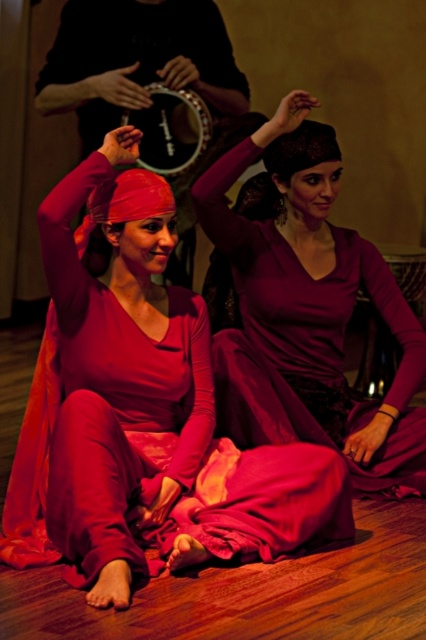
Is point (83, 276) farther from viewer compared to point (195, 125)?

That is False.

Find the location of a particular element. This screenshot has width=426, height=640. matte pink fabric at center is located at coordinates (154, 416).

Find the location of a particular element. This screenshot has height=640, width=426. matte pink fabric at center is located at coordinates (154, 416).

You are a GUI agent. You are given a task and a screenshot of the screen. Output one action in this format:
    pyautogui.click(x=<x>, y=<y>)
    Task: Click on the matte pink fabric at center
    Image resolution: width=426 pixels, height=640 pixels.
    Given the screenshot: What is the action you would take?
    pyautogui.click(x=154, y=416)

Between matte purple dress at center and black leather tambourine at upper center, which one is positioned lower?

Positioned lower is matte purple dress at center.

Between matte purple dress at center and black leather tambourine at upper center, which one has less height?

Result: Standing shorter between the two is black leather tambourine at upper center.

Is point (339, 360) farther from camera compared to point (181, 170)?

No, it is not.

Locate an element on the screen. matte purple dress at center is located at coordinates (307, 310).

At what (x,y) coordinates should I click in order to perform the action: click on matte pink fabric at center. Please return your answer as a coordinate pair (x, y). Image resolution: width=426 pixels, height=640 pixels. Looking at the image, I should click on (154, 416).

What do you see at coordinates (154, 416) in the screenshot? I see `matte pink fabric at center` at bounding box center [154, 416].

Who is more forward, (x=103, y=497) or (x=226, y=211)?

Point (x=103, y=497) is in front.

Identify the location of matte pink fabric at center. (154, 416).